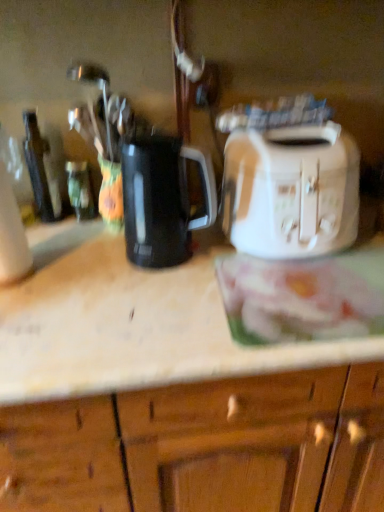
Image resolution: width=384 pixels, height=512 pixels. Find the location of `free point above white glossy toaster at upper right (from a real-world perspective)`. free point above white glossy toaster at upper right (from a real-world perspective) is located at coordinates (169, 269).